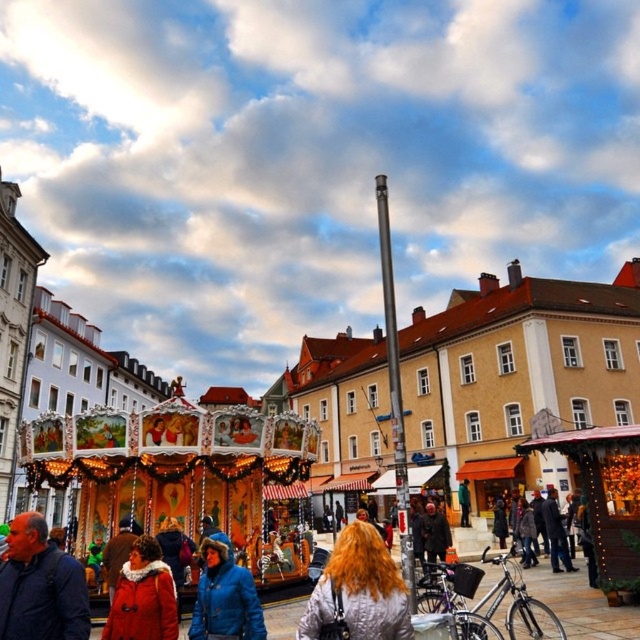
You are standing at the front of the scene and want to take a photo of both the dark blue jacket at lower left and the silky red hair at center. Which object should you adjust your camera focus to first to ensure both are in the frame?

The dark blue jacket at lower left is closer to the viewer than the silky red hair at center, so you should focus on the dark blue jacket at lower left first to ensure both are in the frame.

You are standing in the town square and want to take a photo of both the bicycle and the carousel. The bicycle is located at point [49,625] and the carousel is at point [196,604]. Based on their positions, which object is closer to you so that you can focus on it first?

Point [49,625] is closer to the camera than point [196,604], so the bicycle at point [49,625] is closer to you and should be focused on first.

You are standing at the center of the town square and want to take a photo of the point at coordinates (54,584). Your camera has a focal length of 50mm and you are currently 30 meters away from the point. Should you move closer or farther away to focus on the point properly?

The point at coordinates (54,584) is 24.09 meters away from the camera. Since you are currently 30 meters away, you need to move closer to reduce the distance to 24.09 meters for proper focus.